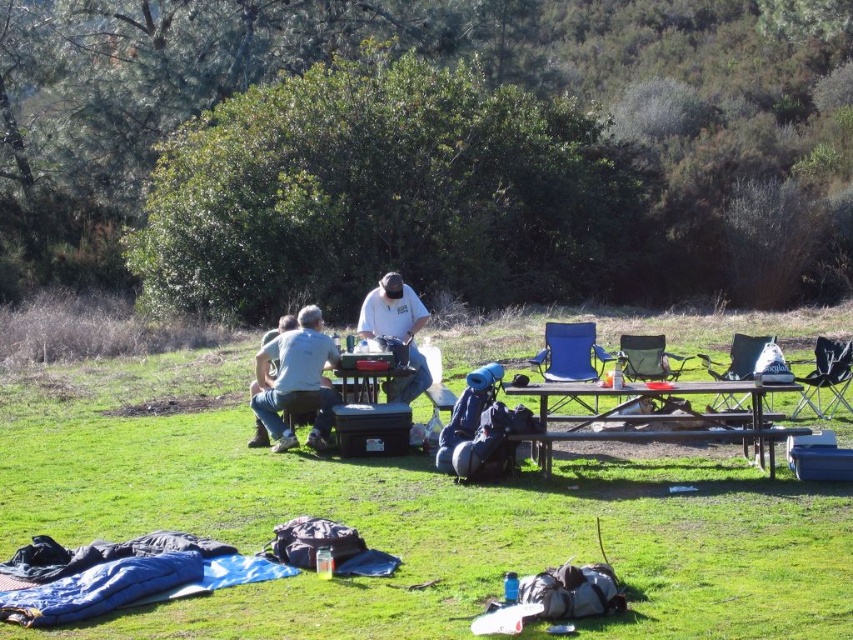
You are planning to set up a small tent in the area between the green fabric chair at center and the metallic silver table at center. According to the scene description, can the tent be placed there without overlapping any objects?

The green fabric chair at center is positioned over the metallic silver table at center, so there is no space between them to place the tent without overlapping the objects.